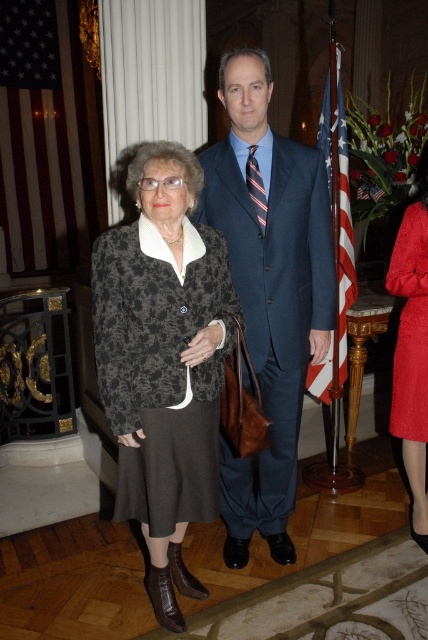
Question: Which of the following is the closest to the observer?

Choices:
 (A) floral-patterned fabric coat at center
 (B) american flag at right
 (C) red satin dress at right
 (D) blue suit at center

Answer: (A)

Question: Can you confirm if blue suit at center is positioned below american flag at right?

Choices:
 (A) yes
 (B) no

Answer: (A)

Question: Is blue suit at center further to the viewer compared to american flag at right?

Choices:
 (A) no
 (B) yes

Answer: (A)

Question: Which point is closer to the camera?

Choices:
 (A) (416, 412)
 (B) (244, 88)

Answer: (B)

Question: Which of the following is the farthest from the observer?

Choices:
 (A) american flag at right
 (B) floral-patterned fabric coat at center
 (C) blue suit at center

Answer: (A)

Question: Is floral-patterned fabric coat at center above red satin dress at right?

Choices:
 (A) no
 (B) yes

Answer: (A)